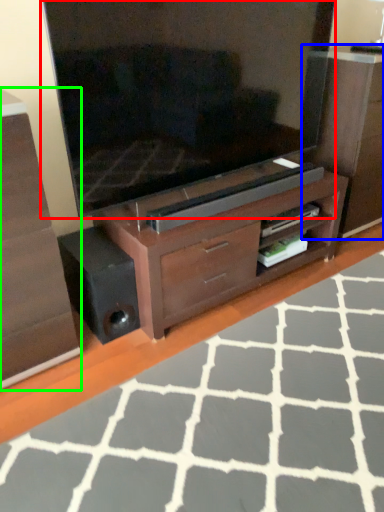
Question: Which object is the closest to the television (highlighted by a red box)? Choose among these: dresser (highlighted by a blue box) or chest of drawers (highlighted by a green box).

Choices:
 (A) dresser
 (B) chest of drawers

Answer: (A)